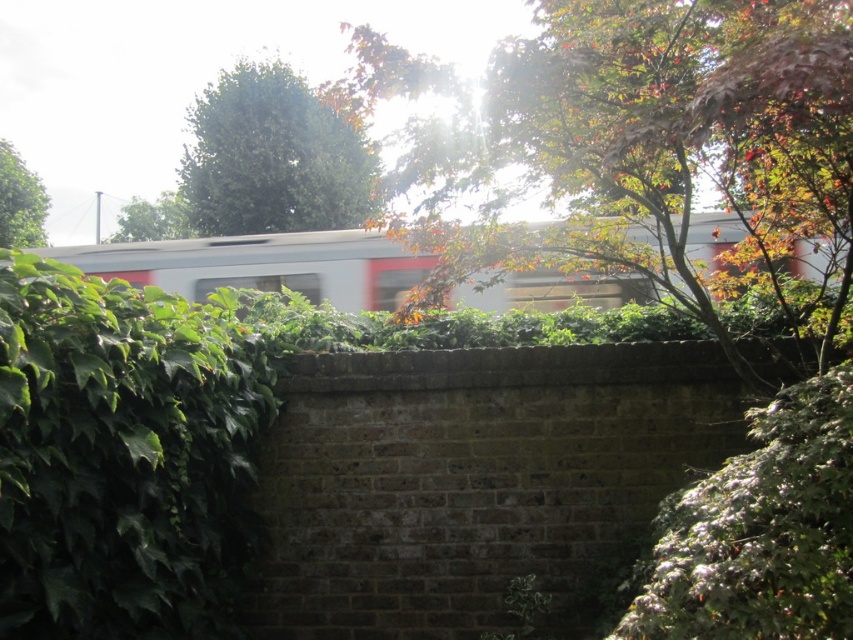
You are a photographer trying to capture the autumn leaves at upper center and the green leafy hedge at center in the same frame. Which object would appear larger in your photo?

The autumn leaves at upper center would appear larger in the photo since they are bigger than the green leafy hedge at center.

You are a landscape architect planning to install a walkway between the green leafy hedge at center and the green leafy tree at left. The walkway requires a minimum of 25 meters to accommodate benches and pathways. Can the space between these two plants support this requirement?

The distance between the green leafy hedge at center and the green leafy tree at left is 27.36 meters, which exceeds the 25 meters required for the walkway. Therefore, the space is sufficient to accommodate the benches and pathways.